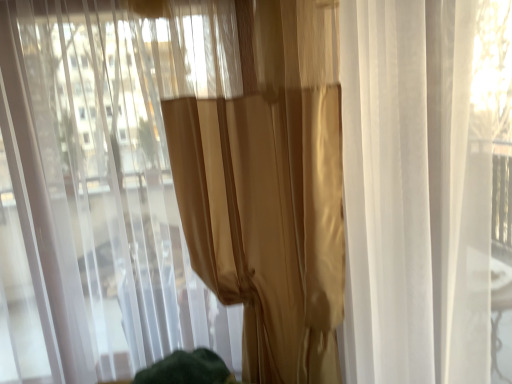
Question: From the image's perspective, is satin gold curtain at center, which is the 1th curtain from right to left, above or below satin gold curtain at center, the first curtain in the left-to-right sequence?

Choices:
 (A) below
 (B) above

Answer: (B)

Question: Looking at the image, does satin gold curtain at center, which is the 1th curtain from right to left, seem bigger or smaller compared to satin gold curtain at center, the first curtain in the left-to-right sequence?

Choices:
 (A) small
 (B) big

Answer: (A)

Question: Is satin gold curtain at center, acting as the second curtain starting from the left, in front of or behind satin gold curtain at center, the first curtain in the left-to-right sequence, in the image?

Choices:
 (A) front
 (B) behind

Answer: (B)

Question: From a real-world perspective, relative to satin gold curtain at center, acting as the second curtain starting from the left, is satin gold curtain at center, the first curtain in the left-to-right sequence, vertically above or below?

Choices:
 (A) above
 (B) below

Answer: (B)

Question: In terms of size, does satin gold curtain at center, the first curtain in the left-to-right sequence, appear bigger or smaller than satin gold curtain at center, which is the 1th curtain from right to left?

Choices:
 (A) big
 (B) small

Answer: (A)

Question: In the image, is satin gold curtain at center, the first curtain in the left-to-right sequence, on the left side or the right side of satin gold curtain at center, which is the 1th curtain from right to left?

Choices:
 (A) left
 (B) right

Answer: (A)

Question: Do you think satin gold curtain at center, marked as the second curtain in a right-to-left arrangement, is within satin gold curtain at center, which is the 1th curtain from right to left, or outside of it?

Choices:
 (A) inside
 (B) outside

Answer: (B)